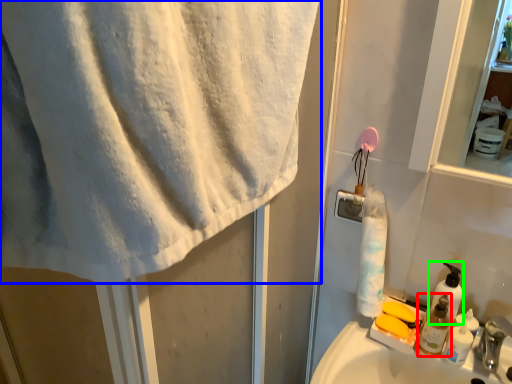
Question: Which object is the farthest from toiletry (highlighted by a red box)? Choose among these: towel (highlighted by a blue box) or soap dispenser (highlighted by a green box).

Choices:
 (A) towel
 (B) soap dispenser

Answer: (A)